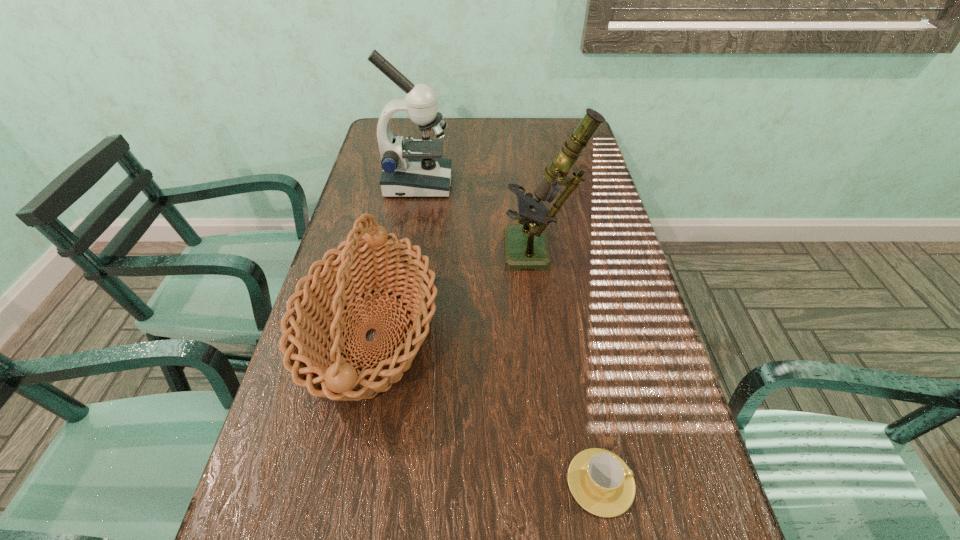
I want to click on the left microscope, so click(x=415, y=168).

Locate an element on the screen. This screenshot has height=540, width=960. the farther microscope is located at coordinates (415, 168).

Find the location of `the nearer microscope`. the nearer microscope is located at coordinates (526, 247).

Image resolution: width=960 pixels, height=540 pixels. I want to click on the third tallest object, so pos(316,309).

Identify the location of the nearest object. (600, 481).

The height and width of the screenshot is (540, 960). In order to click on cup in this screenshot , I will do `click(600, 481)`.

The width and height of the screenshot is (960, 540). I want to click on free region located at the eyepiece of the farther microscope, so click(x=494, y=184).

Locate an element on the screen. This screenshot has width=960, height=540. vacant space located at the eyepiece of the right microscope is located at coordinates (483, 254).

The height and width of the screenshot is (540, 960). I want to click on free space located at the eyepiece of the right microscope, so click(x=361, y=254).

The image size is (960, 540). I want to click on free space located at the eyepiece of the right microscope, so click(x=409, y=254).